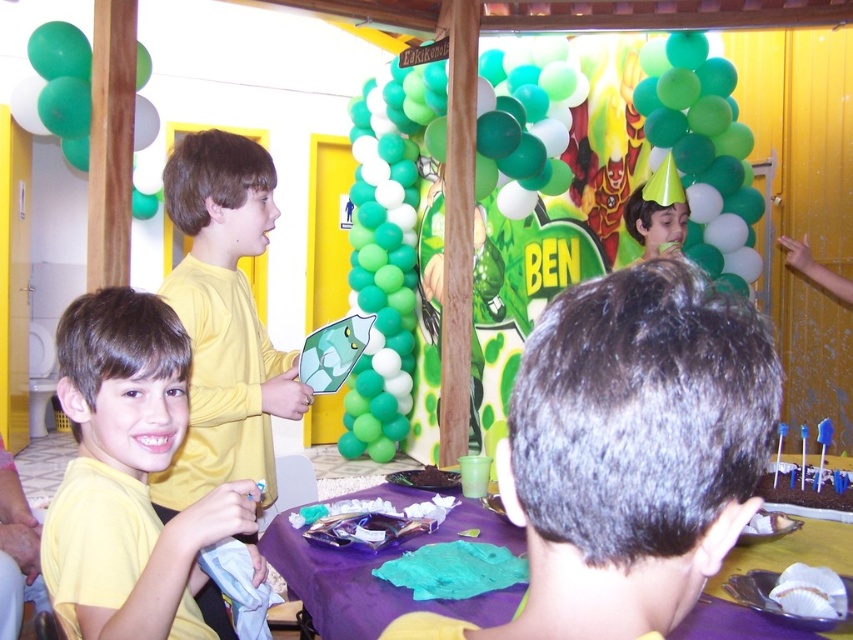
Is point (196, 566) closer to viewer compared to point (329, 564)?

Yes.

Between yellow matte shirt at lower left and purple fabric table at lower center, which one has more height?

yellow matte shirt at lower left is taller.

You are a GUI agent. You are given a task and a screenshot of the screen. Output one action in this format:
    pyautogui.click(x=<x>, y=<y>)
    Task: Click on the yellow matte shirt at lower left
    This screenshot has width=853, height=640.
    Given the screenshot: What is the action you would take?
    pyautogui.click(x=128, y=476)

Locate an element on the screen. yellow matte shirt at lower left is located at coordinates (128, 476).

Who is more distant from viewer, (698, 625) or (636, 93)?

Point (636, 93)

Between purple fabric table at lower center and green matte balloon at upper right, which one appears on the left side from the viewer's perspective?

From the viewer's perspective, purple fabric table at lower center appears more on the left side.

Which is in front, point (347, 616) or point (706, 93)?

Point (347, 616) is in front.

This screenshot has height=640, width=853. Identify the location of purple fabric table at lower center. (379, 579).

What do you see at coordinates (523, 196) in the screenshot?
I see `green matte balloon at center` at bounding box center [523, 196].

Looking at this image, does green matte balloon at center have a smaller size compared to yellow matte shirt at lower left?

Incorrect, green matte balloon at center is not smaller in size than yellow matte shirt at lower left.

This screenshot has width=853, height=640. I want to click on green matte balloon at center, so click(x=523, y=196).

Find the location of `green matte balloon at center`. green matte balloon at center is located at coordinates (523, 196).